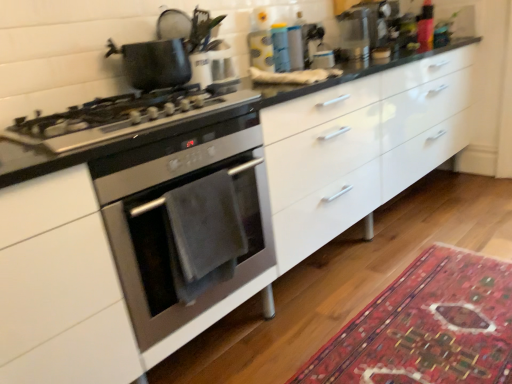
Question: Considering the relative sizes of satin silver gas stove at left and carpet with intricate patterns at lower right in the image provided, is satin silver gas stove at left shorter than carpet with intricate patterns at lower right?

Choices:
 (A) yes
 (B) no

Answer: (B)

Question: Is satin silver gas stove at left smaller than carpet with intricate patterns at lower right?

Choices:
 (A) no
 (B) yes

Answer: (A)

Question: Would you say satin silver gas stove at left contains carpet with intricate patterns at lower right?

Choices:
 (A) no
 (B) yes

Answer: (A)

Question: Could you tell me if satin silver gas stove at left is facing carpet with intricate patterns at lower right?

Choices:
 (A) yes
 (B) no

Answer: (B)

Question: Are satin silver gas stove at left and carpet with intricate patterns at lower right located far from each other?

Choices:
 (A) yes
 (B) no

Answer: (A)

Question: Considering the relative sizes of satin silver gas stove at left and carpet with intricate patterns at lower right in the image provided, is satin silver gas stove at left thinner than carpet with intricate patterns at lower right?

Choices:
 (A) yes
 (B) no

Answer: (A)

Question: Does matte black pot at upper left have a greater width compared to satin silver gas stove at left?

Choices:
 (A) no
 (B) yes

Answer: (A)

Question: Is matte black pot at upper left oriented away from satin silver gas stove at left?

Choices:
 (A) no
 (B) yes

Answer: (A)

Question: Does matte black pot at upper left have a larger size compared to satin silver gas stove at left?

Choices:
 (A) no
 (B) yes

Answer: (A)

Question: Is matte black pot at upper left further to camera compared to satin silver gas stove at left?

Choices:
 (A) yes
 (B) no

Answer: (A)

Question: Does matte black pot at upper left have a lesser width compared to satin silver gas stove at left?

Choices:
 (A) no
 (B) yes

Answer: (B)

Question: Considering the relative sizes of matte black pot at upper left and satin silver gas stove at left in the image provided, is matte black pot at upper left shorter than satin silver gas stove at left?

Choices:
 (A) no
 (B) yes

Answer: (A)

Question: From a real-world perspective, is stainless steel oven at left positioned under matte black pot at upper left based on gravity?

Choices:
 (A) no
 (B) yes

Answer: (B)